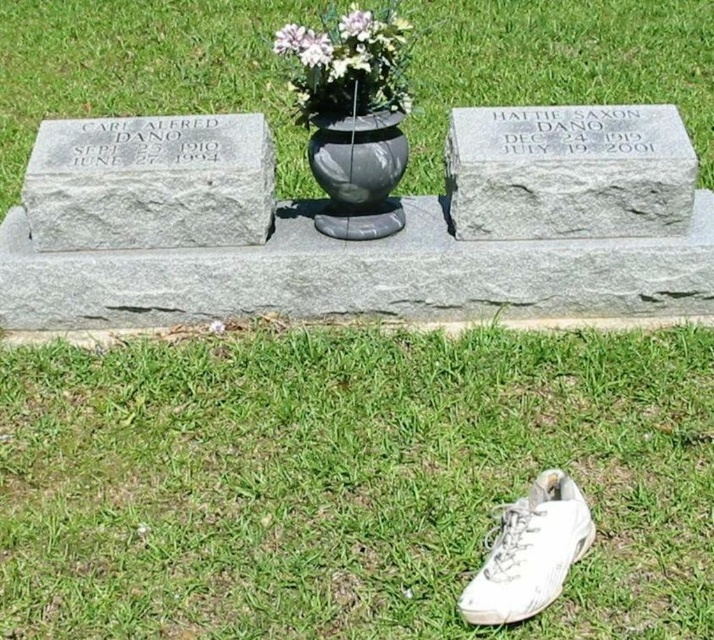
Question: Considering the real-world distances, which object is farthest from the gray stone gravestone at upper left?

Choices:
 (A) green grass at center
 (B) black marble vase at center

Answer: (A)

Question: Can you confirm if black marble vase at center is positioned to the left of white matte vase at center?

Choices:
 (A) no
 (B) yes

Answer: (A)

Question: Does gray granite stone at center appear on the right side of white matte vase at center?

Choices:
 (A) no
 (B) yes

Answer: (B)

Question: Is green grass at center to the left of gray stone gravestone at upper left from the viewer's perspective?

Choices:
 (A) no
 (B) yes

Answer: (B)

Question: Considering the real-world distances, which object is farthest from the white matte vase at center?

Choices:
 (A) black marble vase at center
 (B) green grass at center
 (C) gray stone gravestone at upper left
 (D) matte black vase at center

Answer: (B)

Question: Which is farther from the gray granite stone at center?

Choices:
 (A) white leather shoe at lower right
 (B) green grass at center
 (C) white matte vase at center
 (D) gray stone gravestone at upper left

Answer: (B)